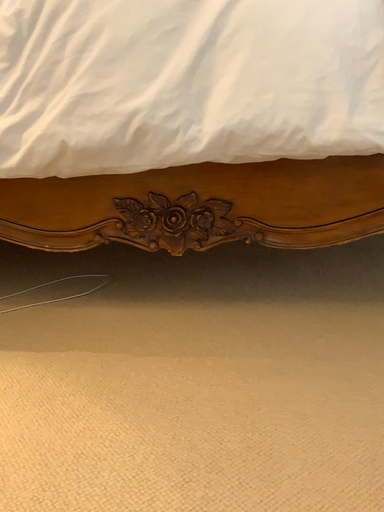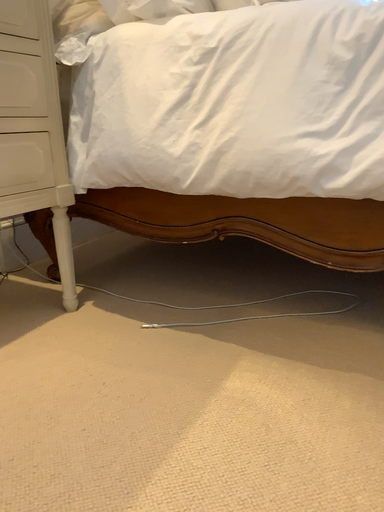
Question: How did the camera likely rotate when shooting the video?

Choices:
 (A) rotated left
 (B) rotated right

Answer: (A)